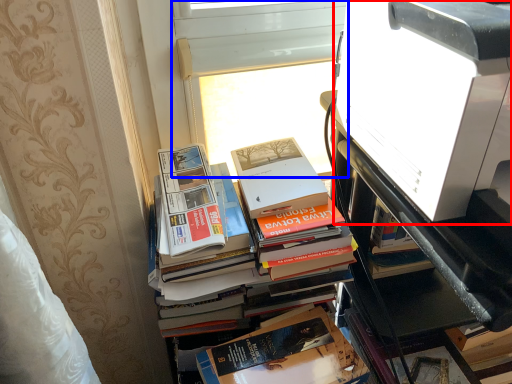
Question: Which of the following is the closest to the observer, printer (highlighted by a red box) or window screen (highlighted by a blue box)?

Choices:
 (A) printer
 (B) window screen

Answer: (A)